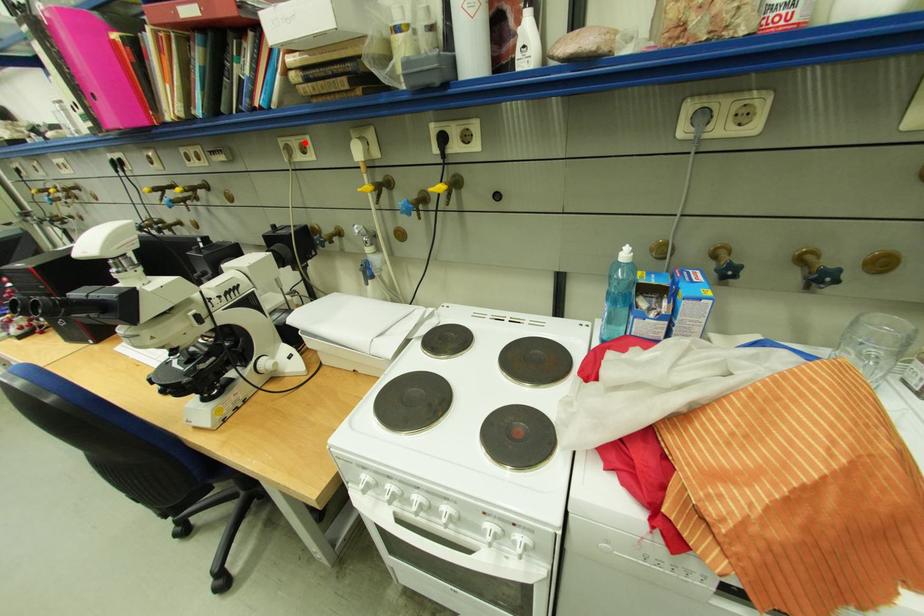
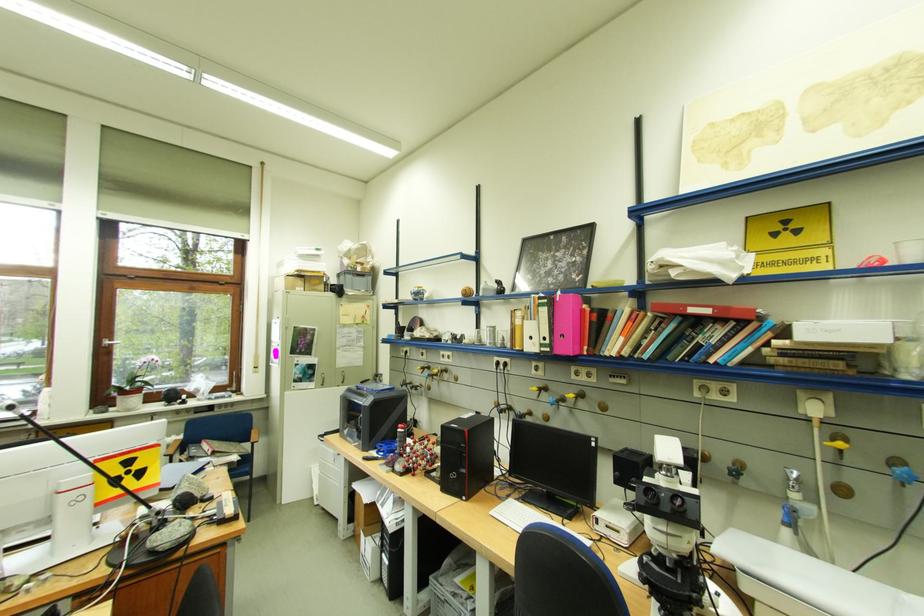
Where in the second image is the point corresponding to the highlighted location from the first image?

(724, 387)